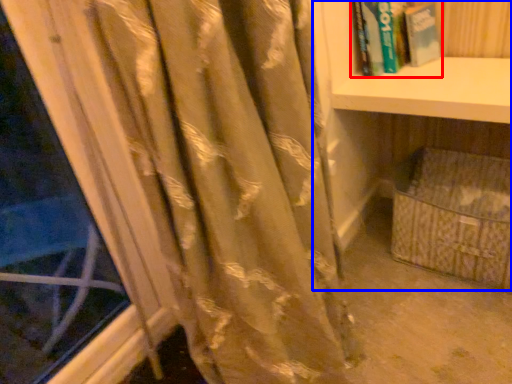
Question: Which point is closer to the camera, book (highlighted by a red box) or bookcase (highlighted by a blue box)?

Choices:
 (A) book
 (B) bookcase

Answer: (B)